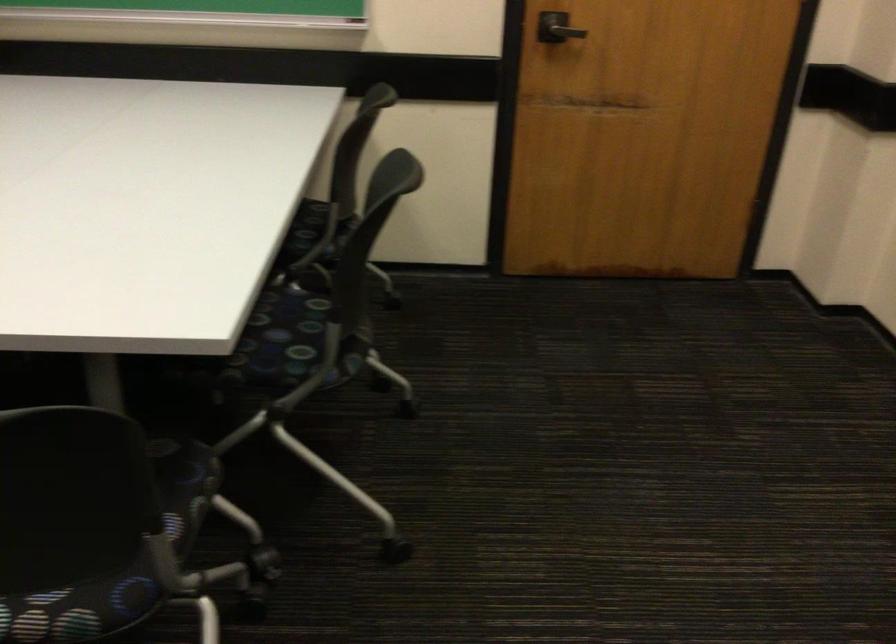
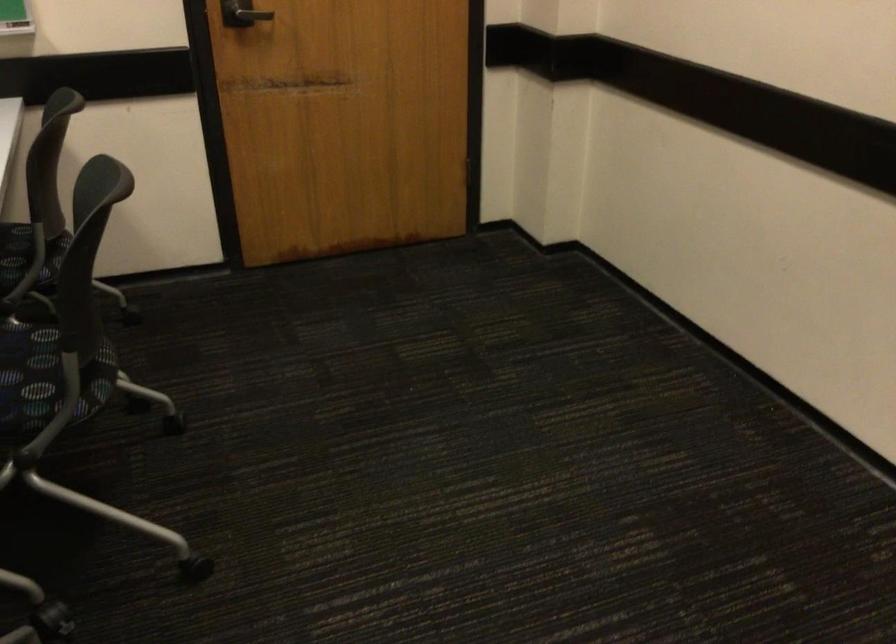
Which direction would the cameraman need to move to produce the second image?

The cameraman moved toward left, backward.